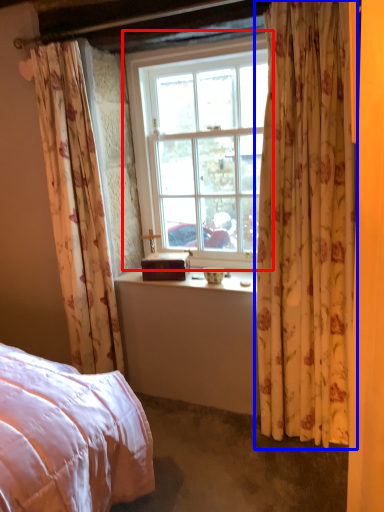
Question: Which of the following is the farthest to the observer, window (highlighted by a red box) or curtain (highlighted by a blue box)?

Choices:
 (A) window
 (B) curtain

Answer: (A)